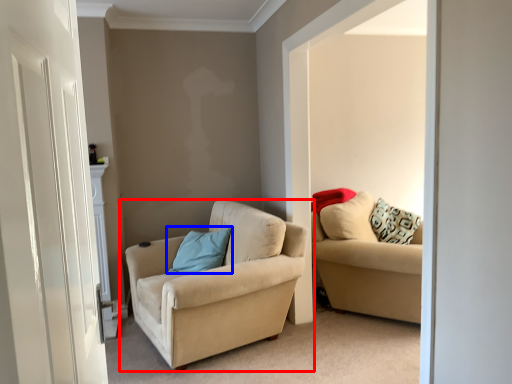
Question: Which object is closer to the camera taking this photo, studio couch (highlighted by a red box) or pillow (highlighted by a blue box)?

Choices:
 (A) studio couch
 (B) pillow

Answer: (A)